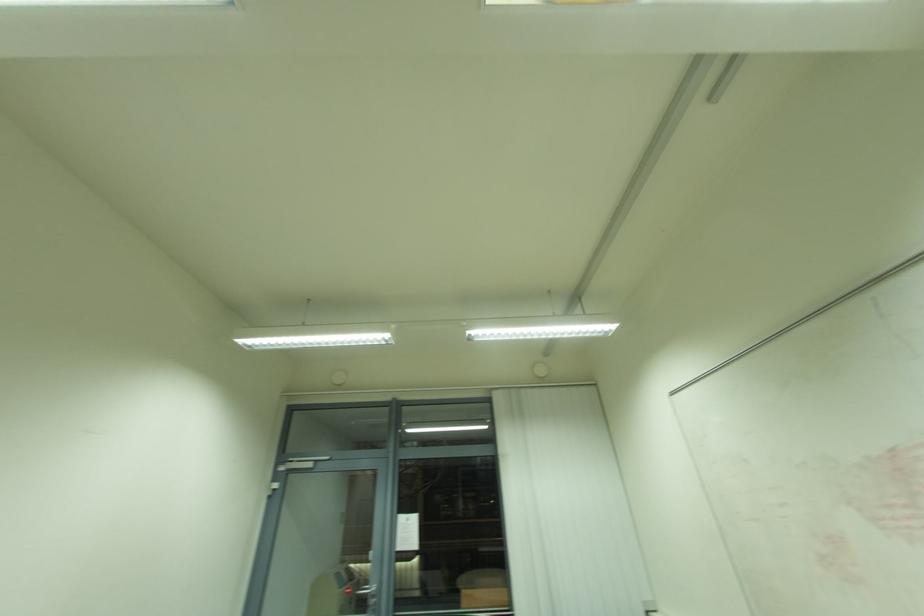
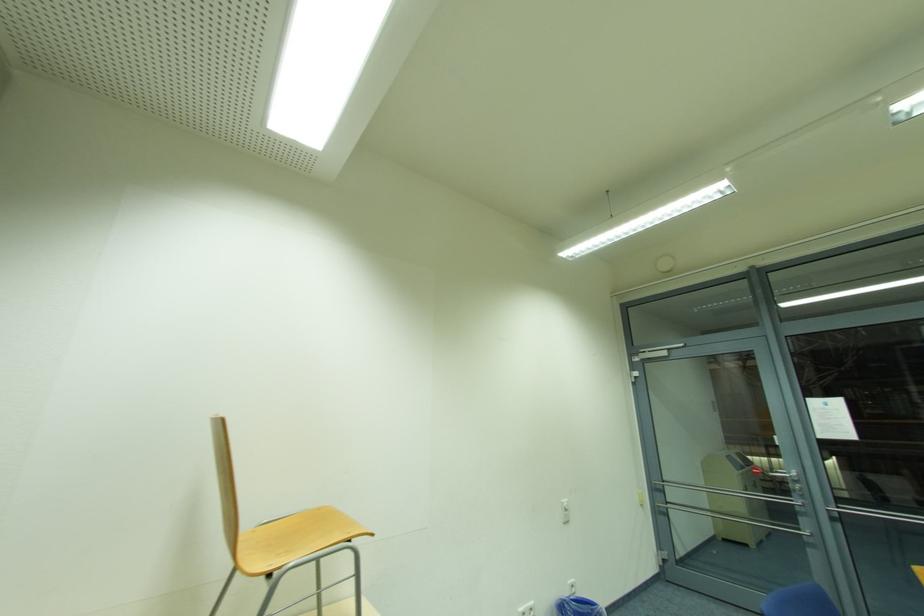
Question: The first image is from the beginning of the video and the second image is from the end. How did the camera likely rotate when shooting the video?

Choices:
 (A) Left
 (B) Right
 (C) Up
 (D) Down

Answer: (A)